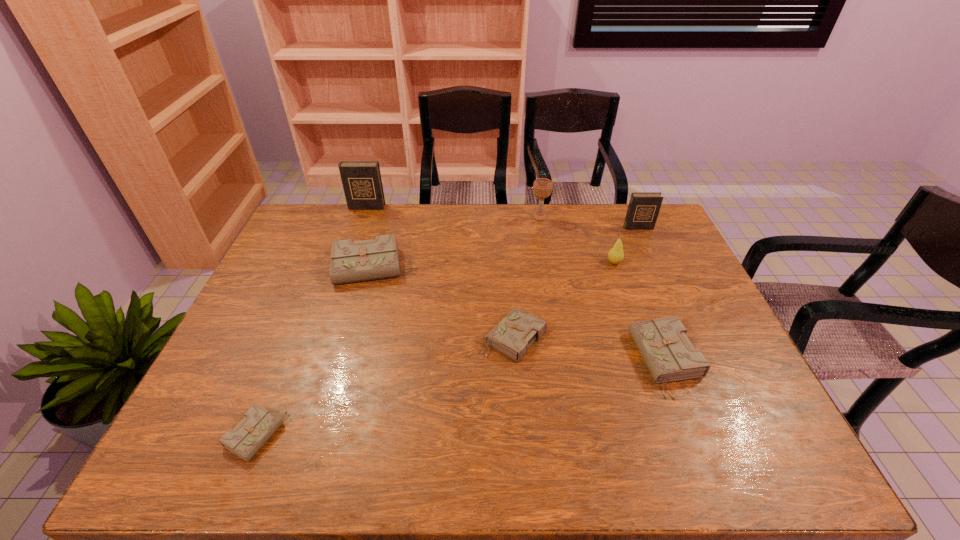
The image size is (960, 540). I want to click on vacant space that's between the third farthest object and the tallest diary, so click(x=502, y=217).

Find the location of a particular element. This screenshot has width=960, height=540. free space between the farthest green diary and the chalice is located at coordinates (457, 242).

This screenshot has height=540, width=960. I want to click on object that is the second closest to the second green diary from right to left, so click(357, 261).

Identify which object is the seventh closest to the fifth object from right to left. Please provide its 2D coordinates. Your answer should be formatted as a tuple, i.e. [(x, y)], where the tuple contains the x and y coordinates of a point satisfying the conditions above.

[(361, 180)]

Where is `the sixth closest diary to the pear`? Image resolution: width=960 pixels, height=540 pixels. the sixth closest diary to the pear is located at coordinates (251, 433).

Find the location of `diary identified as the third closest to the right dark diary`. diary identified as the third closest to the right dark diary is located at coordinates (357, 261).

Identify which green diary is the fourth closest to the fifth object from left to right. Please provide its 2D coordinates. Your answer should be formatted as a tuple, i.e. [(x, y)], where the tuple contains the x and y coordinates of a point satisfying the conditions above.

[(251, 433)]

This screenshot has width=960, height=540. I want to click on green diary that can be found as the third closest to the fifth tallest diary, so click(x=251, y=433).

You are a GUI agent. You are given a task and a screenshot of the screen. Output one action in this format:
    pyautogui.click(x=<x>, y=<y>)
    Task: Click on the free space that satisfies the following two spatial constraints: 1. on the front side of the sixth tallest object; 2. on the left side of the fifth tallest object
    The height and width of the screenshot is (540, 960).
    Given the screenshot: What is the action you would take?
    pyautogui.click(x=348, y=361)

What are the coordinates of `vacant area in the image that satisfies the following two spatial constraints: 1. on the front cover of the rightmost green diary; 2. on the right side of the farthest object` in the screenshot? It's located at (313, 361).